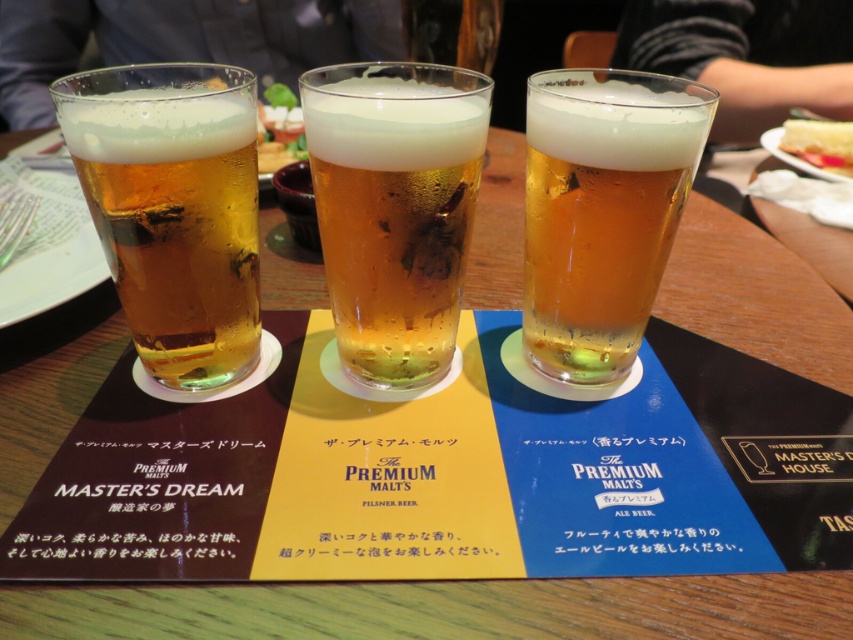
You are at a restaurant and see the translucent glass beer at center and the green leafy vegetable at center on the table. Which item is closer to you?

The translucent glass beer at center is closer to you because it is positioned under the green leafy vegetable at center, meaning the vegetable is above it.

What is located at the coordinates point (175, 221) in the image?

At point (175, 221) lies translucent amber glass at left.